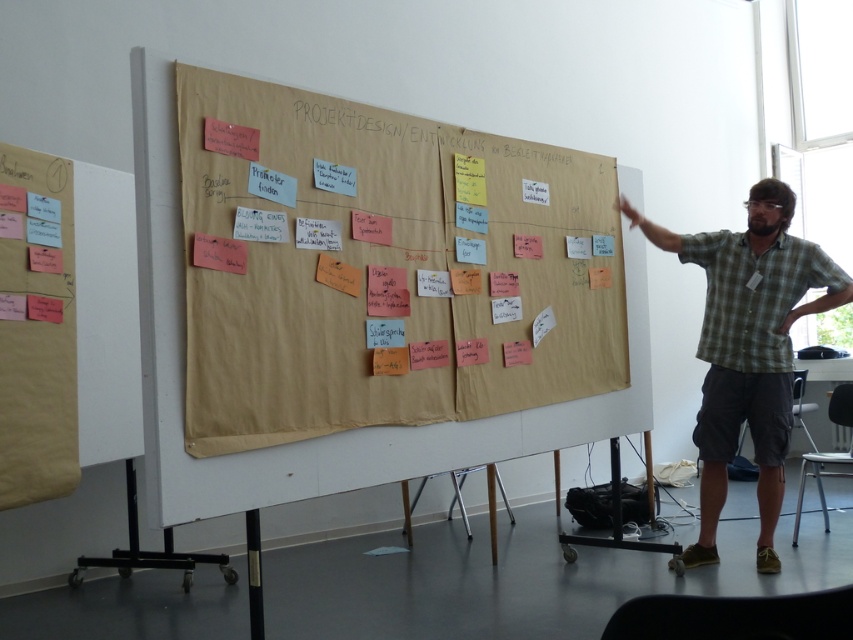
You are a project manager in a meeting and need to refer to both the brown paper at center and the white paper at center on the whiteboard. Which paper should you point to first if you want to start with the one on the left?

The white paper at center is on the left side of the brown paper at center, so you should point to the white paper at center first.

You are organizing a presentation and need to ensure that the green plaid shirt at right and the white paper at center are both visible to the audience. Given their sizes, which object might block the view of the other?

The green plaid shirt at right is larger in size than the white paper at center, so it might block the view of the white paper at center.

You are attending a meeting and see the green plaid shirt at right and the white paper at center. Which object is positioned to the right of the other?

The green plaid shirt at right is to the right of the white paper at center.